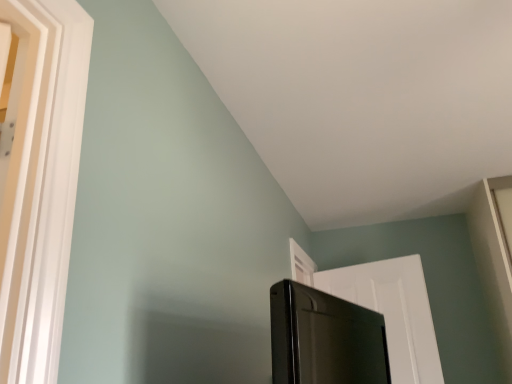
Question: Is white matte door at upper right shorter than black glossy screen door at lower right?

Choices:
 (A) no
 (B) yes

Answer: (A)

Question: Is white matte door at upper right to the right of black glossy screen door at lower right from the viewer's perspective?

Choices:
 (A) yes
 (B) no

Answer: (A)

Question: From a real-world perspective, is white matte door at upper right physically below black glossy screen door at lower right?

Choices:
 (A) no
 (B) yes

Answer: (A)

Question: From the image's perspective, is white matte door at upper right beneath black glossy screen door at lower right?

Choices:
 (A) yes
 (B) no

Answer: (A)

Question: From a real-world perspective, is white matte door at upper right positioned over black glossy screen door at lower right based on gravity?

Choices:
 (A) no
 (B) yes

Answer: (B)

Question: Considering the relative sizes of white matte door at upper right and black glossy screen door at lower right in the image provided, is white matte door at upper right thinner than black glossy screen door at lower right?

Choices:
 (A) no
 (B) yes

Answer: (B)

Question: Is black glossy screen door at lower right facing towards white matte door at upper right?

Choices:
 (A) yes
 (B) no

Answer: (B)

Question: Is black glossy screen door at lower right taller than white matte door at upper right?

Choices:
 (A) yes
 (B) no

Answer: (B)

Question: Is black glossy screen door at lower right further to the viewer compared to white matte door at upper right?

Choices:
 (A) no
 (B) yes

Answer: (A)

Question: Is black glossy screen door at lower right outside of white matte door at upper right?

Choices:
 (A) no
 (B) yes

Answer: (B)

Question: Is the position of black glossy screen door at lower right less distant than that of white matte door at upper right?

Choices:
 (A) no
 (B) yes

Answer: (B)

Question: Does black glossy screen door at lower right have a lesser width compared to white matte door at upper right?

Choices:
 (A) no
 (B) yes

Answer: (A)

Question: In terms of width, does white matte door at upper right look wider or thinner when compared to black glossy screen door at lower right?

Choices:
 (A) thin
 (B) wide

Answer: (A)